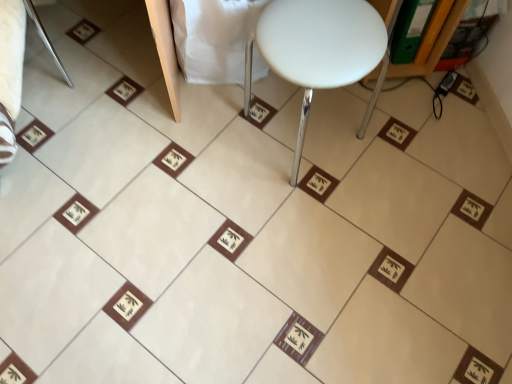
What do you see at coordinates (322, 49) in the screenshot? I see `white glossy stool at center` at bounding box center [322, 49].

This screenshot has width=512, height=384. What are the coordinates of `white glossy stool at center` in the screenshot? It's located at (322, 49).

I want to click on white glossy stool at center, so click(322, 49).